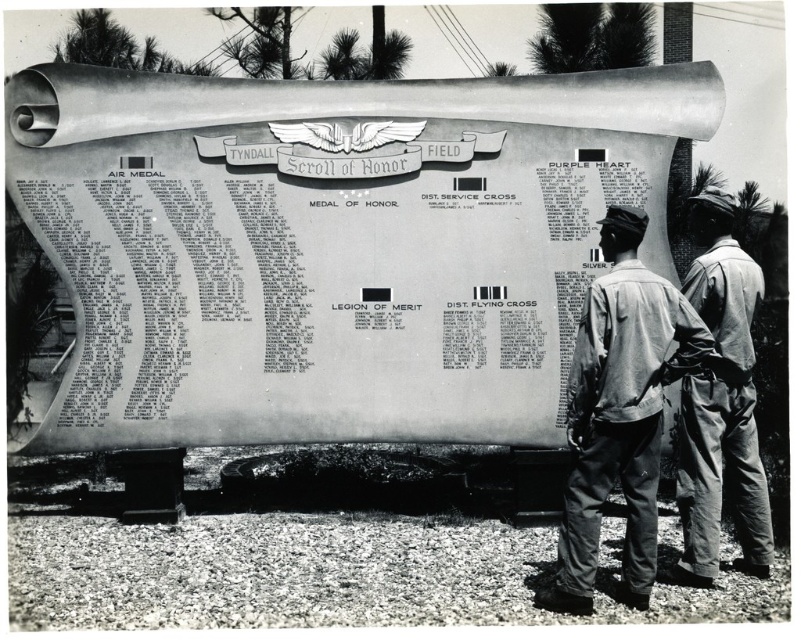
Does gray fabric jacket at center appear over denim pants at lower right?

No, gray fabric jacket at center is not above denim pants at lower right.

Between gray fabric jacket at center and denim pants at lower right, which one has more height?

denim pants at lower right is taller.

This screenshot has width=801, height=640. What do you see at coordinates (618, 412) in the screenshot?
I see `gray fabric jacket at center` at bounding box center [618, 412].

At what (x,y) coordinates should I click in order to perform the action: click on gray fabric jacket at center. Please return your answer as a coordinate pair (x, y). The width and height of the screenshot is (801, 640). Looking at the image, I should click on (618, 412).